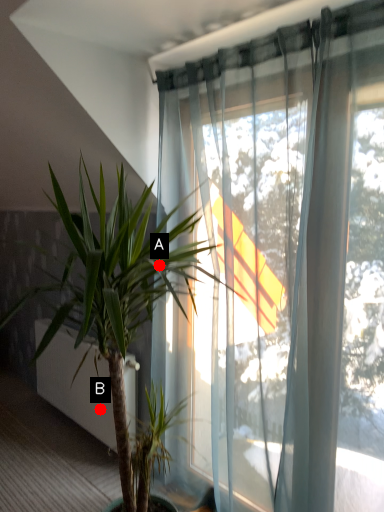
Question: Two points are circled on the image, labeled by A and B beside each circle. Which point is closer to the camera?

Choices:
 (A) A is closer
 (B) B is closer

Answer: (A)